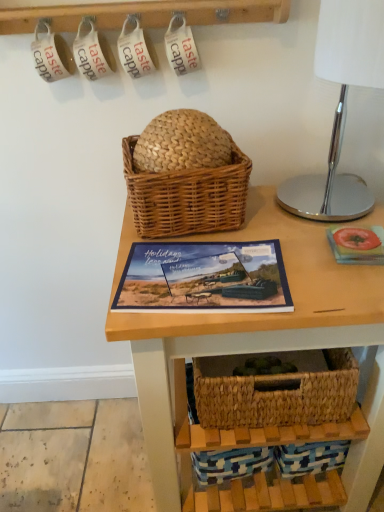
Question: Is matte blue book at center facing towards woven brown picnic basket at center?

Choices:
 (A) no
 (B) yes

Answer: (A)

Question: Is woven brown picnic basket at center at the back of matte blue book at center?

Choices:
 (A) no
 (B) yes

Answer: (B)

Question: From the image's perspective, is matte blue book at center under woven brown picnic basket at center?

Choices:
 (A) no
 (B) yes

Answer: (B)

Question: Considering the relative sizes of matte blue book at center and woven brown picnic basket at center in the image provided, is matte blue book at center taller than woven brown picnic basket at center?

Choices:
 (A) no
 (B) yes

Answer: (A)

Question: Considering the relative sizes of matte blue book at center and woven brown picnic basket at center in the image provided, is matte blue book at center bigger than woven brown picnic basket at center?

Choices:
 (A) no
 (B) yes

Answer: (A)

Question: Is point (201, 170) positioned closer to the camera than point (322, 3)?

Choices:
 (A) closer
 (B) farther

Answer: (B)

Question: From their relative heights in the image, would you say woven brown picnic basket at center is taller or shorter than polished chrome table lamp at right?

Choices:
 (A) tall
 (B) short

Answer: (B)

Question: Relative to polished chrome table lamp at right, is woven brown picnic basket at center in front or behind?

Choices:
 (A) behind
 (B) front

Answer: (A)

Question: From the image's perspective, is woven brown picnic basket at center positioned above or below polished chrome table lamp at right?

Choices:
 (A) below
 (B) above

Answer: (A)

Question: From a real-world perspective, is matte blue book at center positioned above or below woven brown picnic basket at center?

Choices:
 (A) below
 (B) above

Answer: (A)

Question: Based on their sizes in the image, would you say matte blue book at center is bigger or smaller than woven brown picnic basket at center?

Choices:
 (A) small
 (B) big

Answer: (A)

Question: From the image's perspective, is matte blue book at center above or below woven brown picnic basket at center?

Choices:
 (A) above
 (B) below

Answer: (B)

Question: Considering the positions of matte blue book at center and woven brown picnic basket at center in the image, is matte blue book at center wider or thinner than woven brown picnic basket at center?

Choices:
 (A) wide
 (B) thin

Answer: (B)

Question: Looking at the image, does woven wood table at center seem bigger or smaller compared to matte blue book at center?

Choices:
 (A) small
 (B) big

Answer: (B)

Question: Considering the positions of woven wood table at center and matte blue book at center in the image, is woven wood table at center wider or thinner than matte blue book at center?

Choices:
 (A) thin
 (B) wide

Answer: (B)